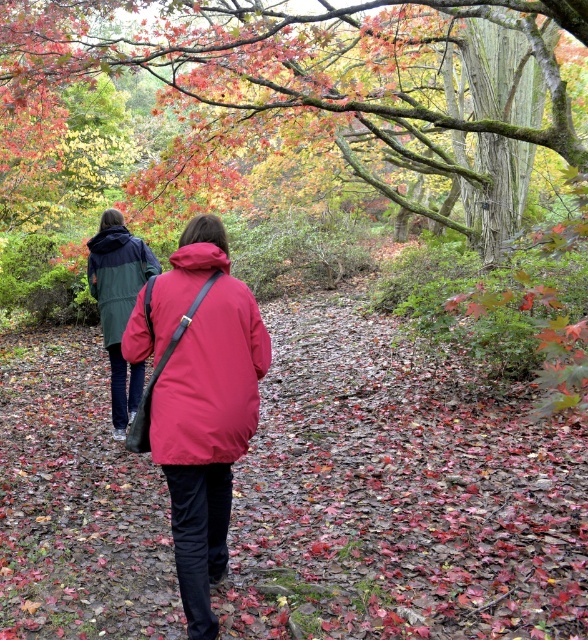
Between point (75, 397) and point (91, 285), which one is positioned behind?

The point (75, 397) is behind.

Measure the distance between leaves at center and camera.

leaves at center is 10.97 feet from camera.

At what (x,y) coordinates should I click in order to perform the action: click on leaves at center. Please return your answer as a coordinate pair (x, y). Looking at the image, I should click on (397, 497).

Between leaves at center and matte red jacket at center, which one has more height?

leaves at center

Between point (128, 516) and point (205, 301), which one is positioned in front?

Point (205, 301) is in front.

Does point (262, 508) lie behind point (222, 339)?

Yes, it is.

Locate an element on the screen. Image resolution: width=588 pixels, height=640 pixels. leaves at center is located at coordinates (397, 497).

Is smooth bark tree at upper center wider than green matte jacket at left?

Yes, smooth bark tree at upper center is wider than green matte jacket at left.

Is smooth bark tree at upper center to the left of green matte jacket at left from the viewer's perspective?

Incorrect, smooth bark tree at upper center is not on the left side of green matte jacket at left.

Is point (522, 22) farther from viewer compared to point (141, 266)?

Yes, it is.

You are a GUI agent. You are given a task and a screenshot of the screen. Output one action in this format:
    pyautogui.click(x=<x>, y=<y>)
    Task: Click on the smooth bark tree at upper center
    The width and height of the screenshot is (588, 640).
    Given the screenshot: What is the action you would take?
    pyautogui.click(x=302, y=100)